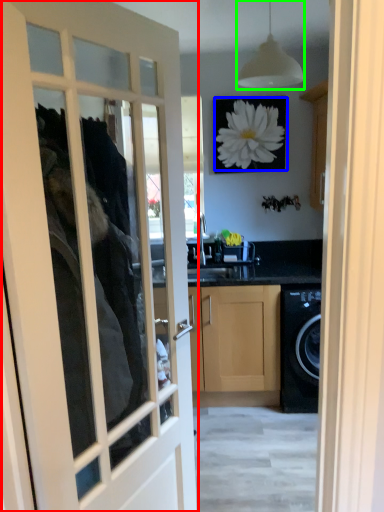
Question: Based on their relative distances, which object is farther from door (highlighted by a red box)? Choose from flower (highlighted by a blue box) and light fixture (highlighted by a green box).

Choices:
 (A) flower
 (B) light fixture

Answer: (B)